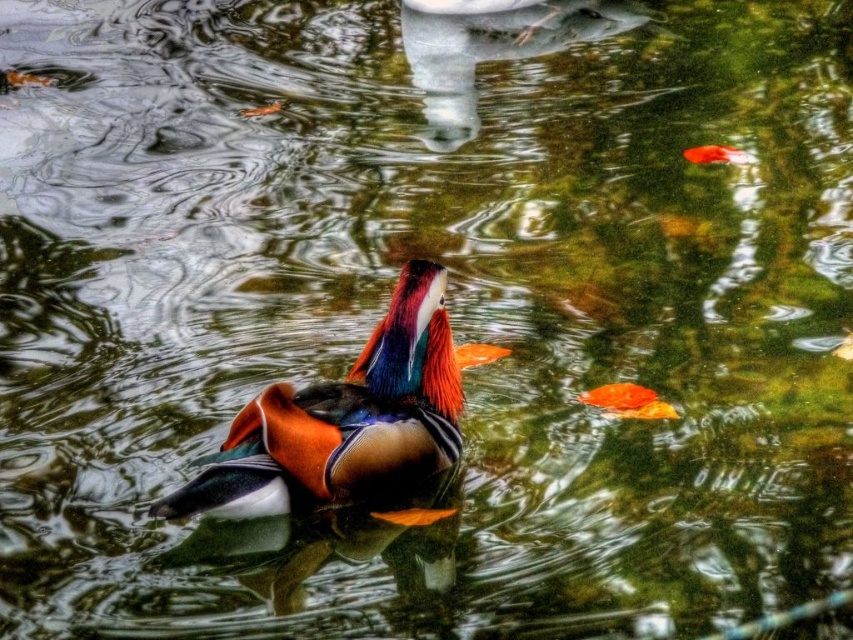
You are an observer looking at the scene. There is a shiny multicolored duck at center and an orange glossy goldfish at center. Which one is positioned more to the right?

The orange glossy goldfish at center is positioned more to the right because the shiny multicolored duck at center is to the left of it.

You are standing on the bank of the water and see the point at (344, 420). Which object is that point on?

The point at (344, 420) is on the shiny multicolored duck at center.

You are a photographer trying to capture the shiny multicolored duck at center and the shiny orange fish at lower right in the same frame. Based on their positions, which one will appear larger in your photo?

The shiny multicolored duck at center will appear larger in the photo because it is closer to the viewer than the shiny orange fish at lower right.